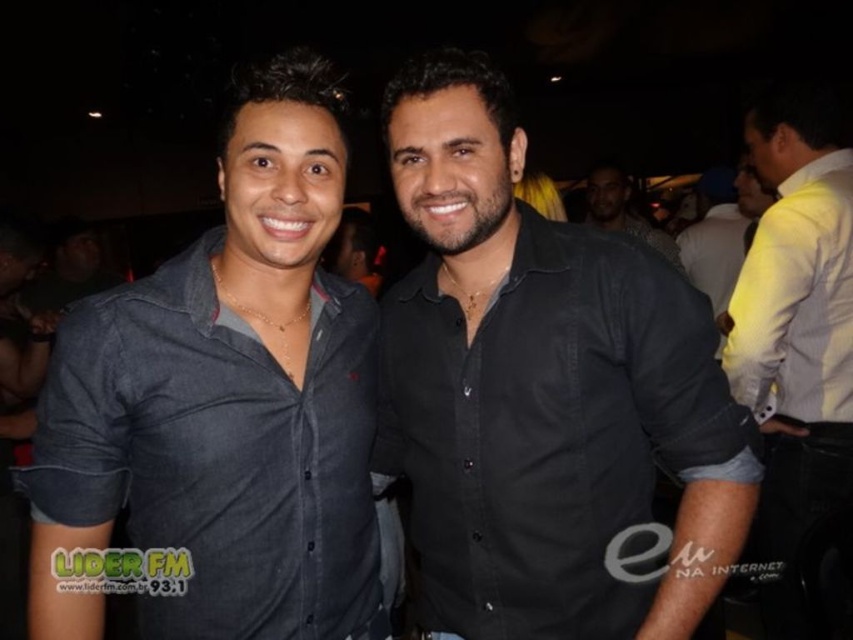
You are at a party and want to take a photo of the denim shirt at center and the yellow cotton shirt at right. If you stand facing them, which shirt should you point your camera to first to capture both in the frame?

The denim shirt at center is to the left of the yellow cotton shirt at right. So, you should point your camera to the left first to include both shirts in the frame.

You are a photographer trying to focus on the point at coordinates point (225, 403). Which object from the scene should you adjust your focus to ensure it captures the point? Please mention the exact object label from the objects list.

The point (225, 403) is on denim shirt at center, so you should focus on the denim shirt at center to capture that point.

From the picture: You are a photographer holding a camera that requires you to be at least 40 inches away from the subject to avoid distortion. You are currently positioned in front of the denim shirt at center. Can you take a clear photo without distortion?

The denim shirt at center and viewer are 36.78 inches apart from each other, which is less than the required 40 inches. Therefore, you cannot take a clear photo without distortion.